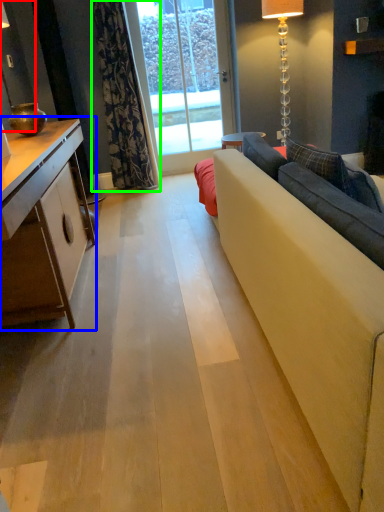
Question: Estimate the real-world distances between objects in this image. Which object is farther from lamp (highlighted by a red box), cabinetry (highlighted by a blue box) or curtain (highlighted by a green box)?

Choices:
 (A) cabinetry
 (B) curtain

Answer: (A)